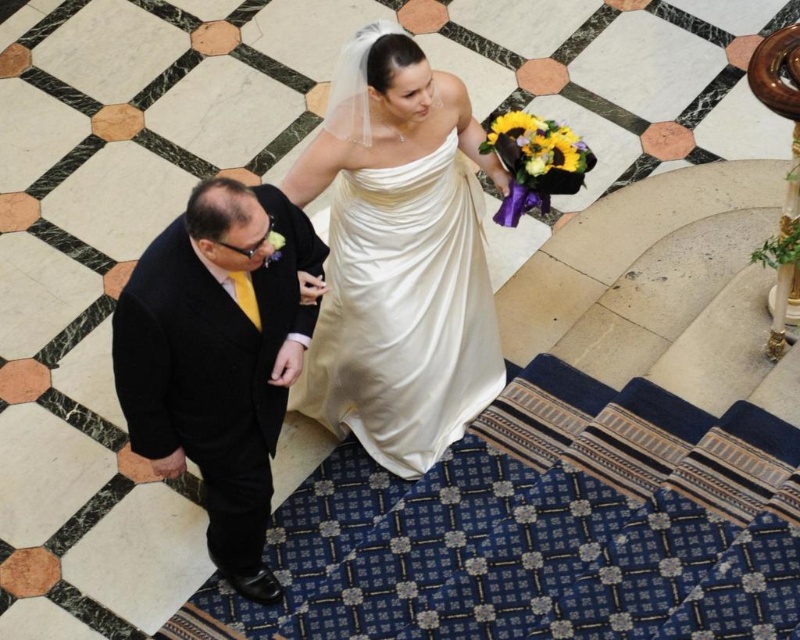
Question: Does white satin dress at center have a lesser width compared to black wool suit at left?

Choices:
 (A) no
 (B) yes

Answer: (A)

Question: Which point is closer to the camera?

Choices:
 (A) (341, 173)
 (B) (437, 252)

Answer: (A)

Question: Does black wool suit at left have a larger size compared to ivory satin dress at center?

Choices:
 (A) no
 (B) yes

Answer: (A)

Question: Can you confirm if white satin dress at center is positioned to the left of black wool suit at left?

Choices:
 (A) yes
 (B) no

Answer: (B)

Question: Based on their relative distances, which object is nearer to the yellow fabric bouquet at center?

Choices:
 (A) ivory satin dress at center
 (B) black wool suit at left

Answer: (A)

Question: Which object is the farthest from the white satin dress at center?

Choices:
 (A) ivory satin dress at center
 (B) black wool suit at left
 (C) yellow fabric bouquet at center

Answer: (B)